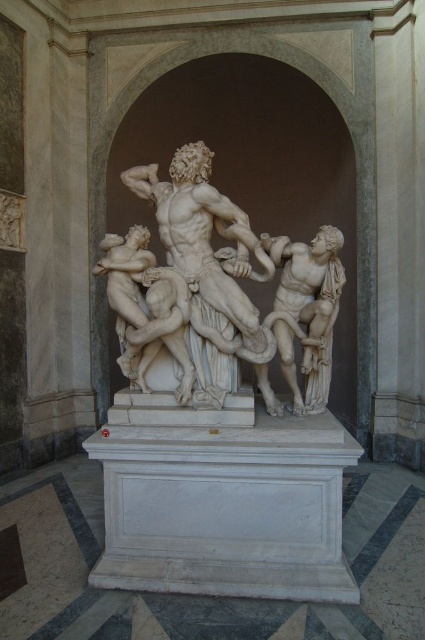
Which of these two, white marble sculpture at center or white marble statue at center, stands shorter?

Standing shorter between the two is white marble statue at center.

The height and width of the screenshot is (640, 425). What do you see at coordinates (217, 285) in the screenshot?
I see `white marble sculpture at center` at bounding box center [217, 285].

Is point (206, 257) positioned after point (322, 330)?

That is True.

The height and width of the screenshot is (640, 425). What are the coordinates of `white marble sculpture at center` in the screenshot? It's located at (217, 285).